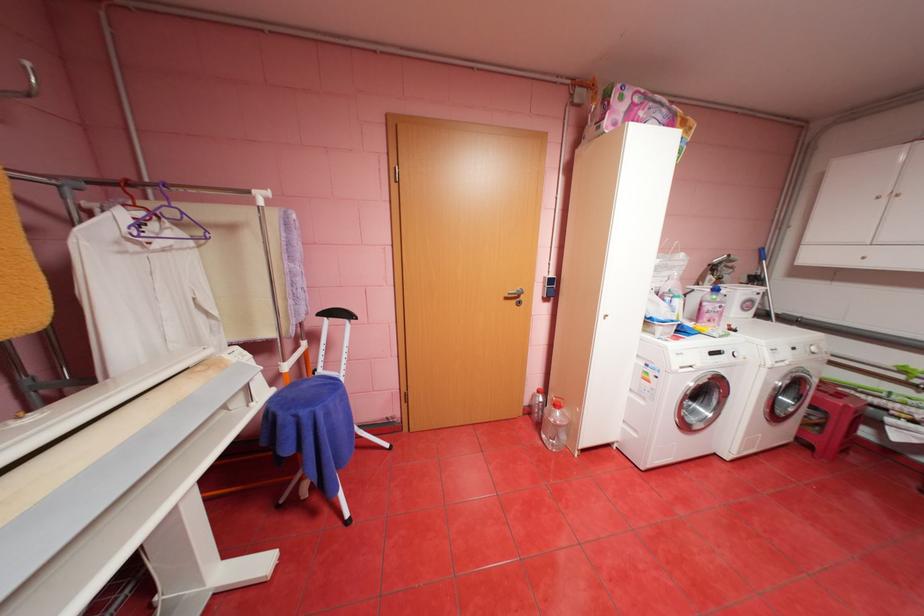
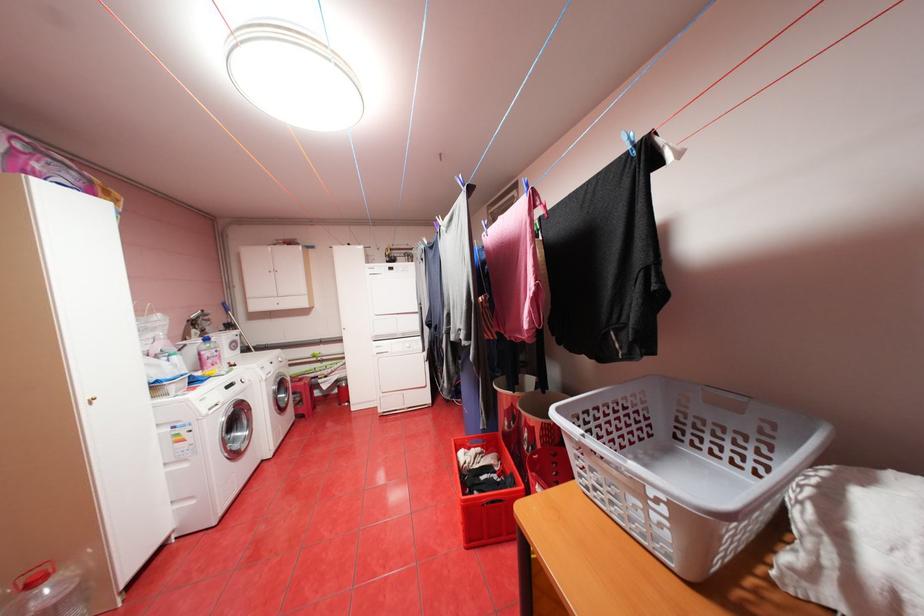
In the second image, find the point that corresponds to (783,400) in the first image.

(286, 400)